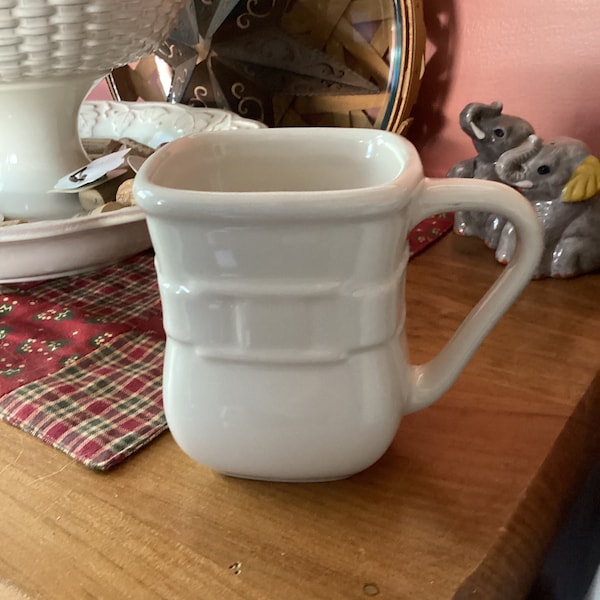
Where is `white cup`? white cup is located at coordinates (293, 257).